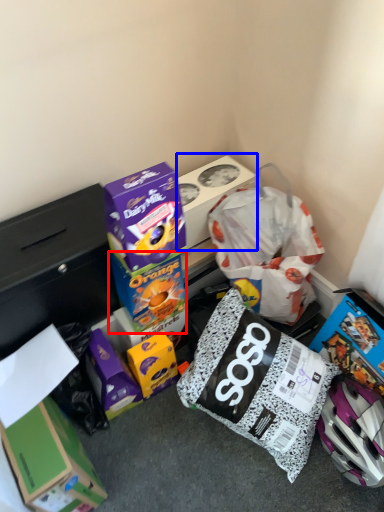
Question: Which object appears farthest to the camera in this image, box (highlighted by a red box) or box (highlighted by a blue box)?

Choices:
 (A) box
 (B) box

Answer: (B)